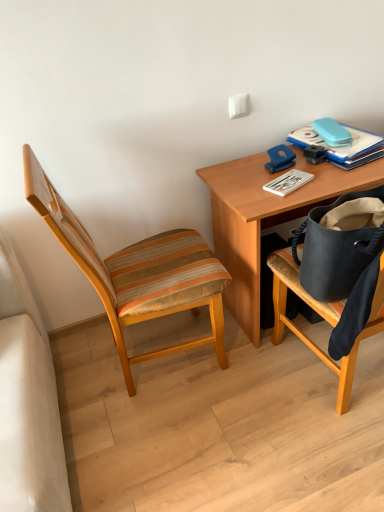
Where is `free spot behind white matte paperback book at upper right, the second paperback book when ordered from right to left`? This screenshot has height=512, width=384. free spot behind white matte paperback book at upper right, the second paperback book when ordered from right to left is located at coordinates (273, 163).